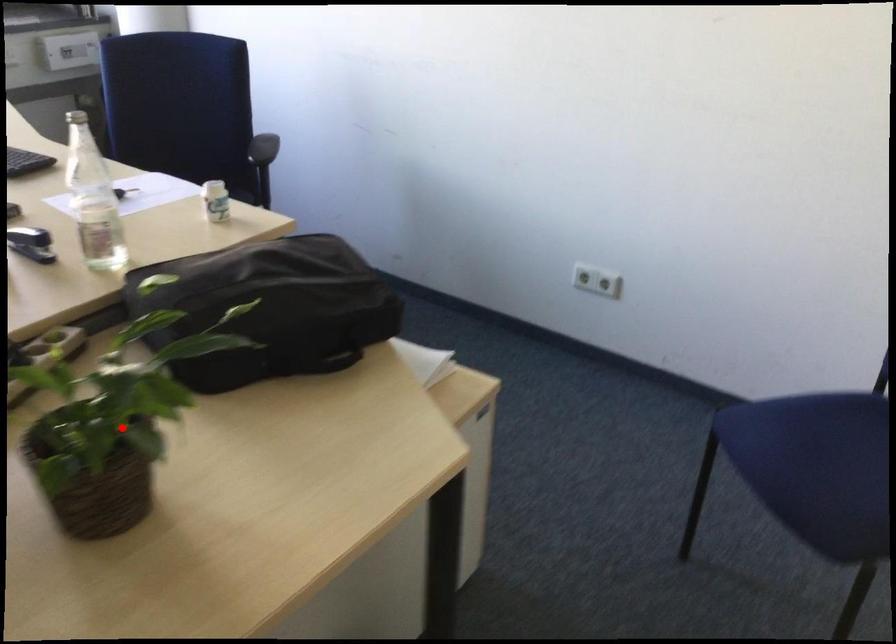
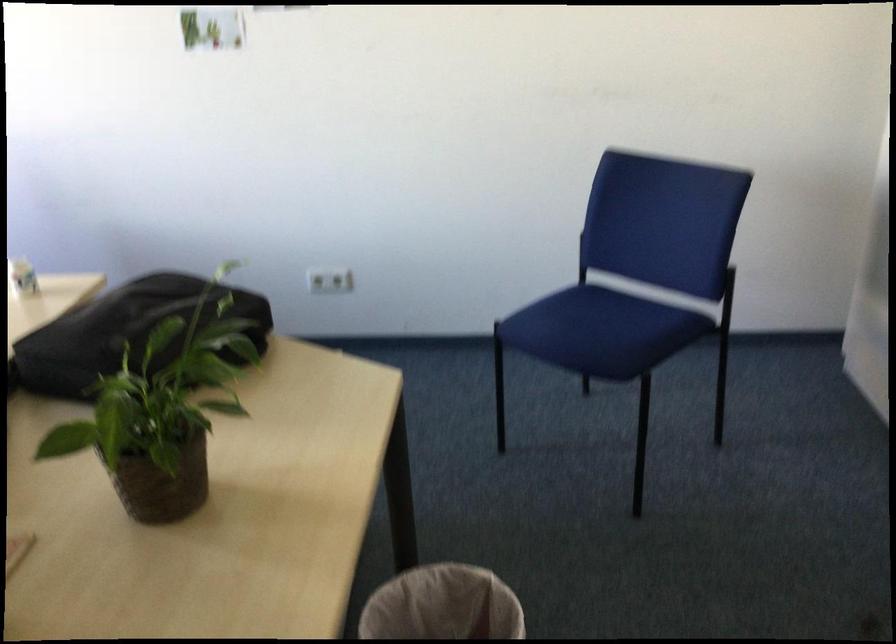
Question: I am providing you with two images of the same scene from different viewpoints. Image1 has a red point marked. In image2, the corresponding 3D location appears at what relative position? Reply with the corresponding letter.

Choices:
 (A) Closer
 (B) Farther

Answer: (B)